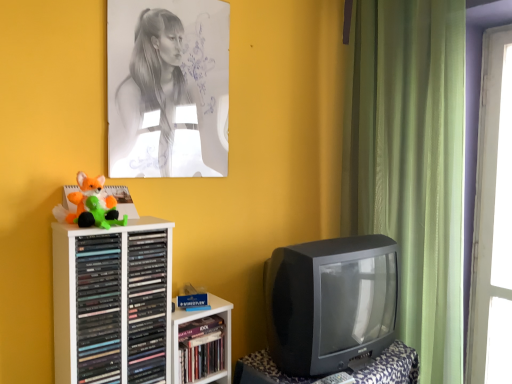
Question: Is black plastic television at lower right surrounding hardcover book at center, acting as the 3th book starting from the left?

Choices:
 (A) no
 (B) yes

Answer: (A)

Question: From a real-world perspective, is black plastic television at lower right positioned under hardcover book at center, which ranks as the first book in right-to-left order, based on gravity?

Choices:
 (A) yes
 (B) no

Answer: (A)

Question: Can you confirm if black plastic television at lower right is bigger than hardcover book at center, which ranks as the first book in right-to-left order?

Choices:
 (A) yes
 (B) no

Answer: (A)

Question: Is black plastic television at lower right placed right next to hardcover book at center, which ranks as the first book in right-to-left order?

Choices:
 (A) yes
 (B) no

Answer: (B)

Question: From a real-world perspective, is black plastic television at lower right on top of hardcover book at center, which ranks as the first book in right-to-left order?

Choices:
 (A) yes
 (B) no

Answer: (B)

Question: Does black plastic television at lower right come behind hardcover book at center, acting as the 3th book starting from the left?

Choices:
 (A) no
 (B) yes

Answer: (A)

Question: Is white plastic shelf at left next to fluffy orange fox at left, which is the 2th toy in bottom-to-top order?

Choices:
 (A) yes
 (B) no

Answer: (B)

Question: From a real-world perspective, is white plastic shelf at left positioned over fluffy orange fox at left, which is the 2th toy in bottom-to-top order, based on gravity?

Choices:
 (A) no
 (B) yes

Answer: (A)

Question: Is white plastic shelf at left facing towards fluffy orange fox at left, which is the 2th toy in bottom-to-top order?

Choices:
 (A) no
 (B) yes

Answer: (A)

Question: From a real-world perspective, is white plastic shelf at left positioned under fluffy orange fox at left, which is counted as the 1th toy, starting from the top, based on gravity?

Choices:
 (A) yes
 (B) no

Answer: (A)

Question: Is white plastic shelf at left to the right of fluffy orange fox at left, which is the 2th toy in bottom-to-top order, from the viewer's perspective?

Choices:
 (A) no
 (B) yes

Answer: (B)

Question: Is white plastic shelf at left closer to camera compared to fluffy orange fox at left, which is counted as the 1th toy, starting from the top?

Choices:
 (A) yes
 (B) no

Answer: (A)

Question: From a real-world perspective, is green plush toy at left, the 2th toy viewed from the top, on top of hardcover book at center, acting as the 3th book starting from the left?

Choices:
 (A) no
 (B) yes

Answer: (B)